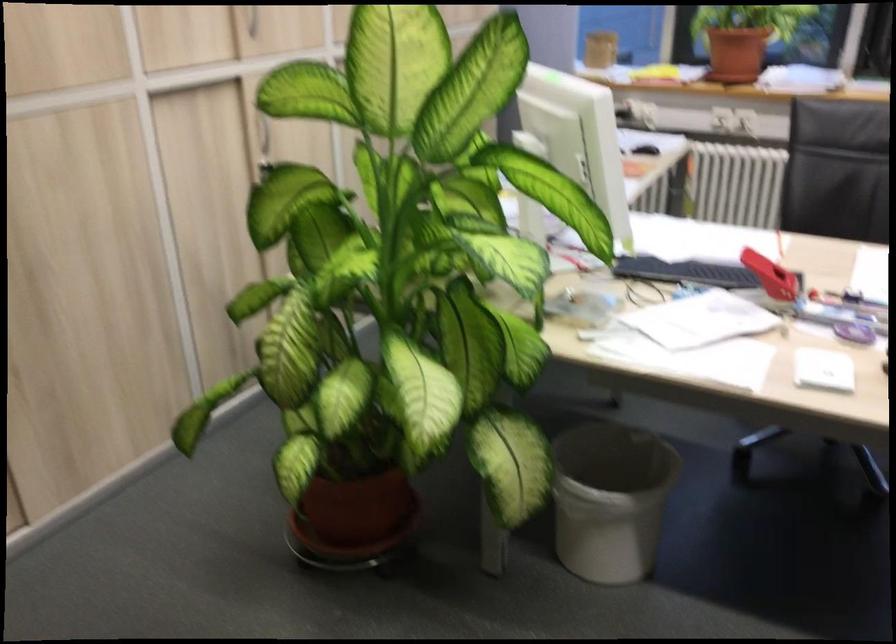
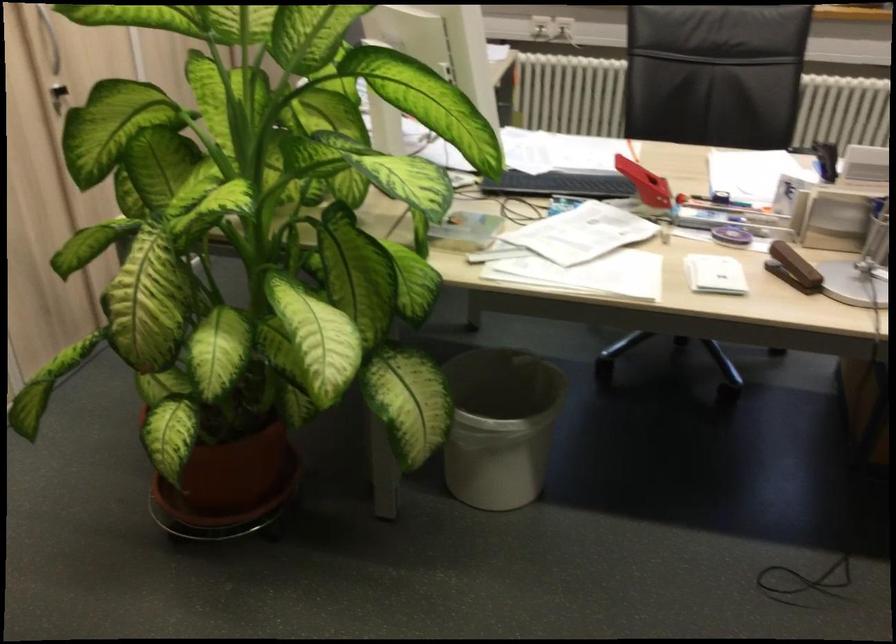
The point at (823, 252) is marked in the first image. Where is the corresponding point in the second image?

(676, 158)